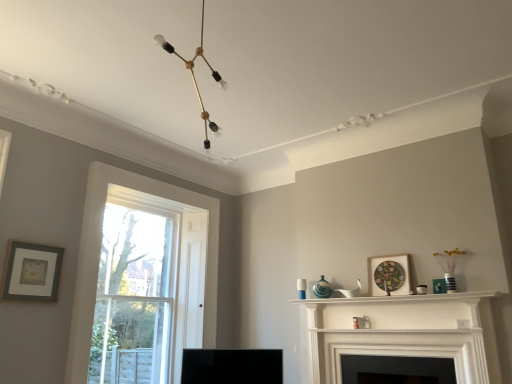
Question: In the image, is white matte fireplace at center, the 2th fireplace in the bottom-to-top sequence, on the left side or the right side of white glossy shelf at upper center?

Choices:
 (A) left
 (B) right

Answer: (B)

Question: Considering their positions, is white matte fireplace at center, which is the 1th fireplace from top to bottom, located in front of or behind white glossy shelf at upper center?

Choices:
 (A) behind
 (B) front

Answer: (B)

Question: Estimate the real-world distances between objects in this image. Which object is closer to the black matte fireplace at center, the first fireplace when ordered from bottom to top?

Choices:
 (A) clear glass window at left
 (B) gold metallic chandelier at upper center
 (C) matte gray picture frame at left, the 2th picture frame when ordered from right to left
 (D) matte wooden picture frame at upper right, acting as the 2th picture frame starting from the left
 (E) white matte fireplace at center, which is the 1th fireplace from top to bottom

Answer: (E)

Question: Which is farther from the white glossy shelf at upper center?

Choices:
 (A) gold metallic chandelier at upper center
 (B) matte wooden picture frame at upper right, which is the first picture frame in right-to-left order
 (C) black matte fireplace at center, the first fireplace when ordered from bottom to top
 (D) matte gray picture frame at left, the 2th picture frame when ordered from right to left
 (E) white matte fireplace at center, the 2th fireplace in the bottom-to-top sequence

Answer: (D)